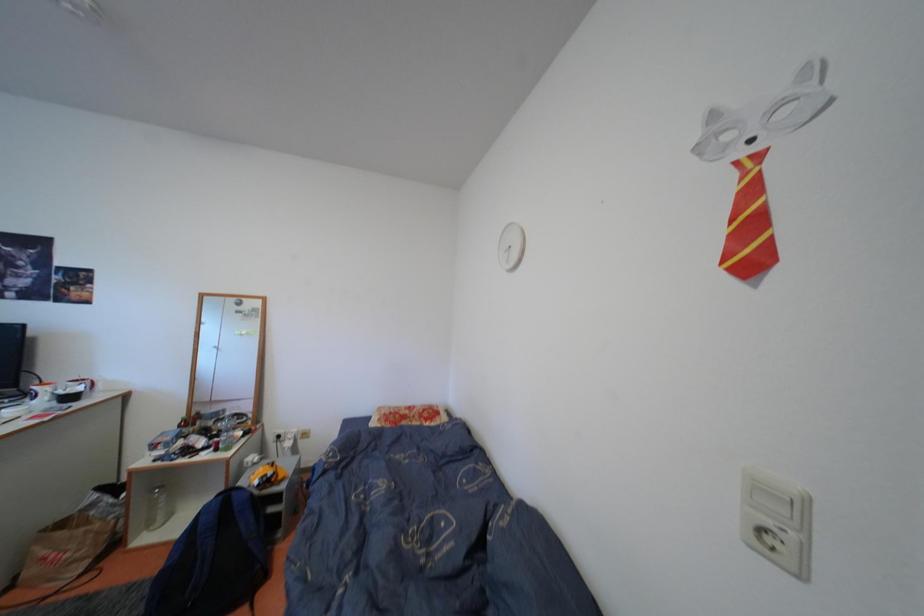
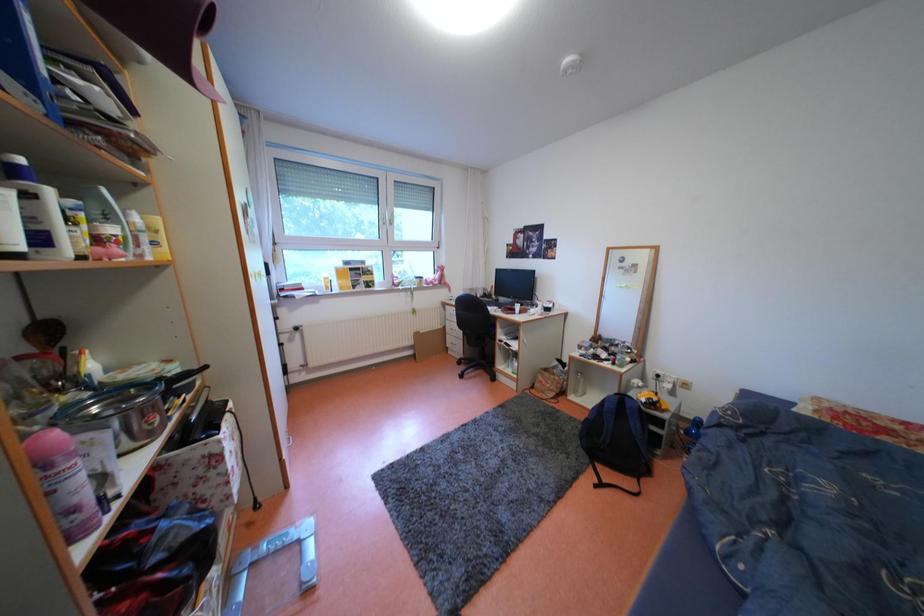
Question: The first image is from the beginning of the video and the second image is from the end. How did the camera likely rotate when shooting the video?

Choices:
 (A) Left
 (B) Right
 (C) Up
 (D) Down

Answer: (A)